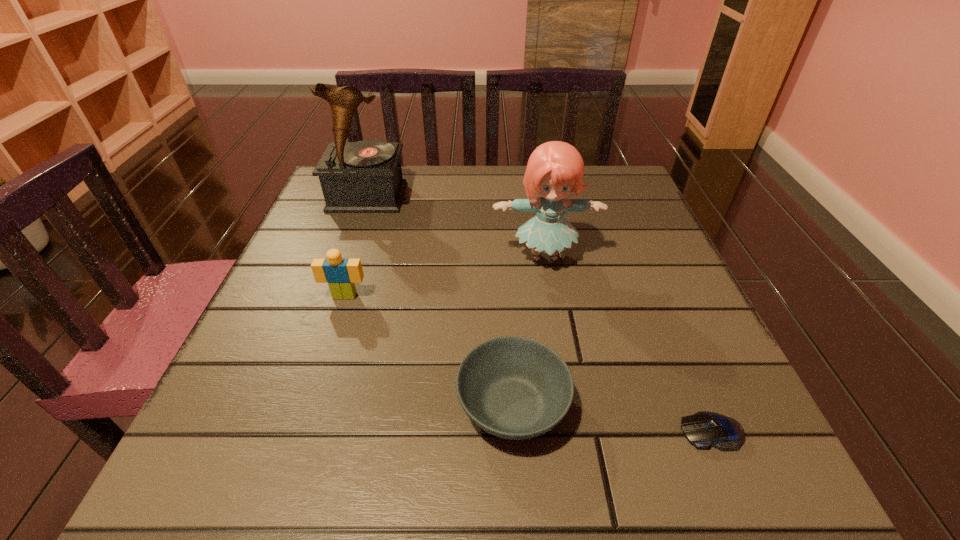
Locate an element on the screen. Image resolution: width=960 pixels, height=540 pixels. the third closest object to the fourth tallest object is located at coordinates pyautogui.click(x=341, y=274).

The height and width of the screenshot is (540, 960). What are the coordinates of `free location that satisfies the following two spatial constraints: 1. at the horn opening of the phonograph_record; 2. on the right side of the soup bowl` in the screenshot? It's located at (294, 406).

At what (x,y) coordinates should I click in order to perform the action: click on free spot that satisfies the following two spatial constraints: 1. on the face of the third farthest object; 2. on the right side of the soup bowl. Please return your answer as a coordinate pair (x, y). The width and height of the screenshot is (960, 540). Looking at the image, I should click on [x=309, y=406].

You are a GUI agent. You are given a task and a screenshot of the screen. Output one action in this format:
    pyautogui.click(x=<x>, y=<y>)
    Task: Click on the free space in the image that satisfies the following two spatial constraints: 1. on the face of the fourth tallest object; 2. on the right side of the third tallest object
    This screenshot has width=960, height=540.
    Given the screenshot: What is the action you would take?
    pyautogui.click(x=309, y=406)

Find the location of a particular element. vacant region that satisfies the following two spatial constraints: 1. on the face of the fourth tallest object; 2. on the left side of the third tallest object is located at coordinates (309, 406).